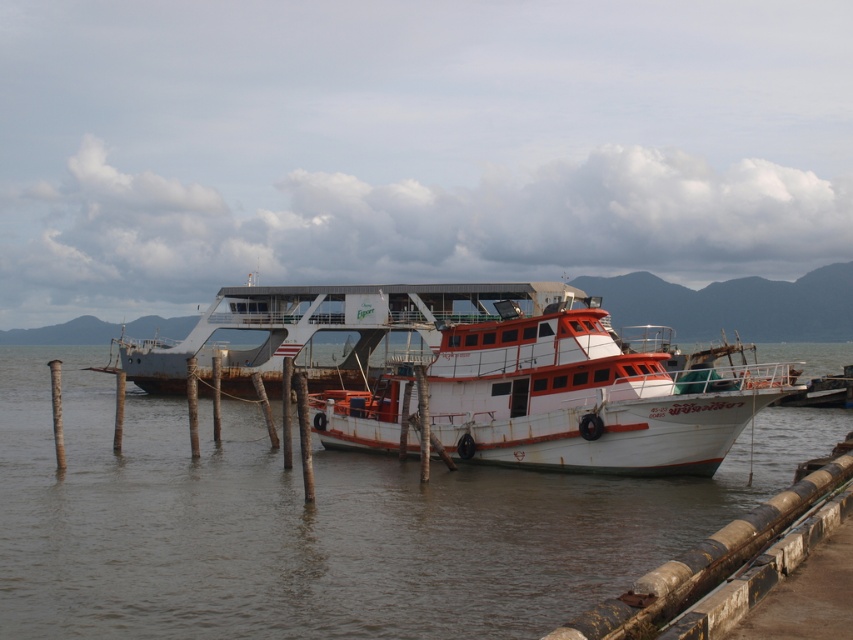
Does white matte boat at center lie in front of rusty metal ferry at center?

That is True.

Which is above, white matte boat at center or rusty metal ferry at center?

Positioned higher is rusty metal ferry at center.

Is point (672, 394) closer to viewer compared to point (236, 385)?

That is True.

The image size is (853, 640). I want to click on white matte boat at center, so click(x=537, y=385).

Does rusty metallic water at center appear on the right side of white matte boat at center?

No, rusty metallic water at center is not to the right of white matte boat at center.

Is point (770, 353) positioned before point (728, 428)?

No, it is not.

Find the location of a particular element. The width and height of the screenshot is (853, 640). rusty metallic water at center is located at coordinates (322, 524).

At what (x,y) coordinates should I click in order to perform the action: click on rusty metallic water at center. Please return your answer as a coordinate pair (x, y). The image size is (853, 640). Looking at the image, I should click on (322, 524).

This screenshot has height=640, width=853. What do you see at coordinates (322, 524) in the screenshot? I see `rusty metallic water at center` at bounding box center [322, 524].

Is rusty metallic water at center to the left of rusty metal ferry at center from the viewer's perspective?

Yes, rusty metallic water at center is to the left of rusty metal ferry at center.

This screenshot has height=640, width=853. I want to click on rusty metallic water at center, so click(x=322, y=524).